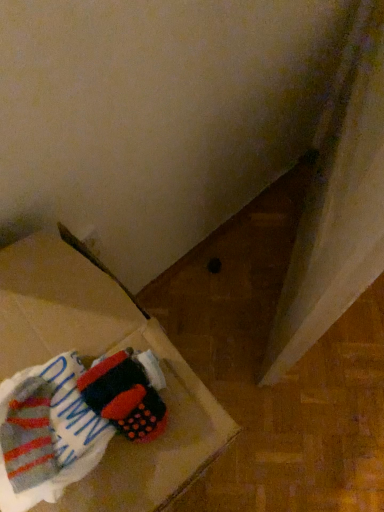
Question: In terms of width, does striped cotton socks at lower left look wider or thinner when compared to white fabric at lower left?

Choices:
 (A) thin
 (B) wide

Answer: (A)

Question: Considering the relative positions of striped cotton socks at lower left and white fabric at lower left in the image provided, is striped cotton socks at lower left to the left or to the right of white fabric at lower left?

Choices:
 (A) right
 (B) left

Answer: (A)

Question: In terms of height, does striped cotton socks at lower left look taller or shorter compared to white fabric at lower left?

Choices:
 (A) short
 (B) tall

Answer: (A)

Question: Would you say white fabric at lower left is to the left or to the right of striped cotton socks at lower left in the picture?

Choices:
 (A) left
 (B) right

Answer: (A)

Question: In terms of height, does white fabric at lower left look taller or shorter compared to striped cotton socks at lower left?

Choices:
 (A) tall
 (B) short

Answer: (A)

Question: Is white fabric at lower left in front of or behind striped cotton socks at lower left in the image?

Choices:
 (A) front
 (B) behind

Answer: (A)

Question: Is white fabric at lower left wider or thinner than striped cotton socks at lower left?

Choices:
 (A) wide
 (B) thin

Answer: (A)